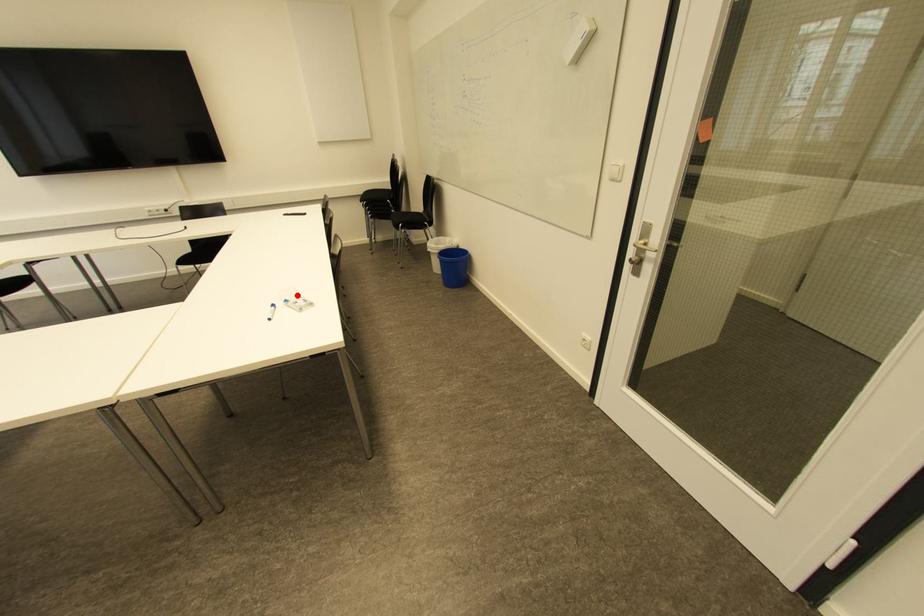
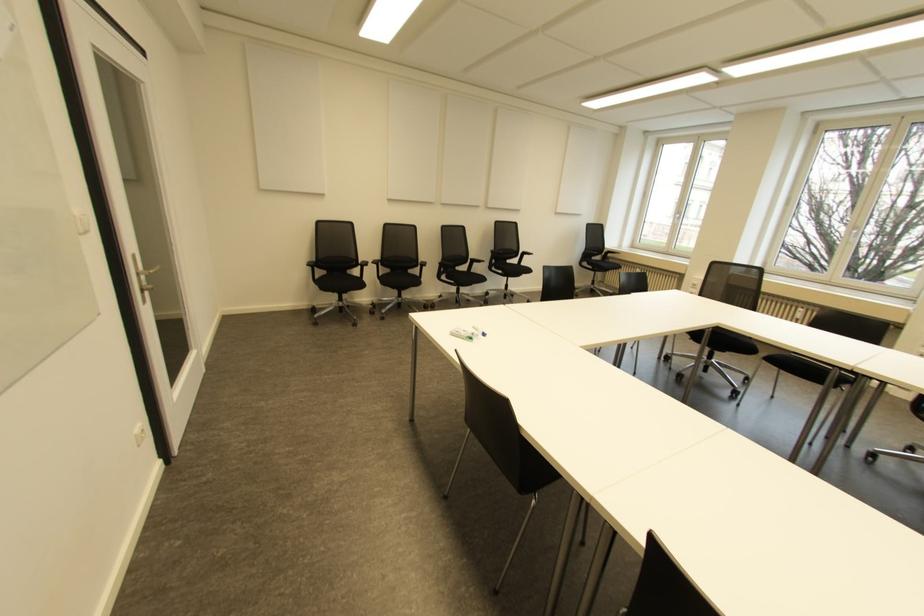
Find the pixel in the second image that matches the highlighted location in the first image.

(470, 338)